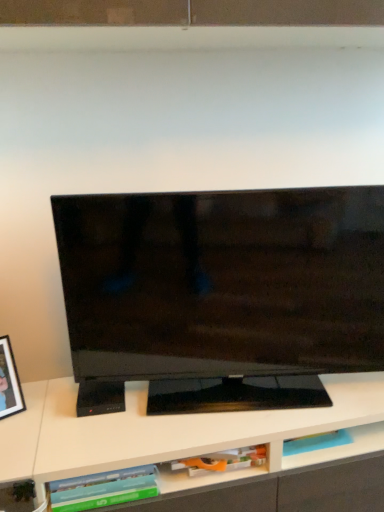
Image resolution: width=384 pixels, height=512 pixels. Find the location of `green matte book at lower center, the second book positioned from the right`. green matte book at lower center, the second book positioned from the right is located at coordinates (103, 489).

Find the location of a particular element. matte orange book at lower center, the 2th book from the left is located at coordinates (223, 461).

Can green matte book at lower center, positioned as the 1th book in left-to-right order, be found inside matte orange book at lower center, the 2th book from the left?

No, matte orange book at lower center, the 2th book from the left, does not contain green matte book at lower center, positioned as the 1th book in left-to-right order.

Which of these two, matte orange book at lower center, which is the 1th book from right to left, or green matte book at lower center, positioned as the 1th book in left-to-right order, is wider?

green matte book at lower center, positioned as the 1th book in left-to-right order, is wider.

Could you tell me if matte orange book at lower center, the 2th book from the left, is facing green matte book at lower center, positioned as the 1th book in left-to-right order?

No, matte orange book at lower center, the 2th book from the left, does not turn towards green matte book at lower center, positioned as the 1th book in left-to-right order.

Is matte orange book at lower center, which is the 1th book from right to left, in contact with green matte book at lower center, the second book positioned from the right?

They are not placed beside each other.

You are a GUI agent. You are given a task and a screenshot of the screen. Output one action in this format:
    pyautogui.click(x=<x>, y=<y>)
    Task: Click on the picture frame below the black glossy tv at center (from a real-world perspective)
    This screenshot has width=384, height=512.
    Given the screenshot: What is the action you would take?
    pyautogui.click(x=9, y=382)

Is point (8, 372) less distant than point (353, 334)?

No.

Would you say black matte picture frame at left is to the left or to the right of black glossy tv at center in the picture?

black matte picture frame at left is to the left of black glossy tv at center.

Is black matte picture frame at left closer to camera compared to black glossy tv at center?

Yes, the depth of black matte picture frame at left is less than that of black glossy tv at center.

From a real-world perspective, is black glossy tv at center on black matte picture frame at left?

Yes, from a real-world perspective, black glossy tv at center is over black matte picture frame at left

From the image's perspective, is black glossy tv at center beneath black matte picture frame at left?

No, from the image's perspective, black glossy tv at center is not below black matte picture frame at left.

Which is nearer, (149,203) or (3,355)?

The point (149,203) is closer to the camera.

Consider the image. Can you tell me how much matte orange book at lower center, which is the 1th book from right to left, and black glossy tv at center differ in facing direction?

The angular difference between matte orange book at lower center, which is the 1th book from right to left, and black glossy tv at center is 9.73 degrees.

Is matte orange book at lower center, which is the 1th book from right to left, aimed at black glossy tv at center?

No, matte orange book at lower center, which is the 1th book from right to left, is not oriented towards black glossy tv at center.

Is the depth of matte orange book at lower center, which is the 1th book from right to left, less than that of black glossy tv at center?

That is False.

Between point (249, 459) and point (73, 241), which one is positioned behind?

The point (249, 459) is farther from the camera.

Which of these two, matte orange book at lower center, which is the 1th book from right to left, or black matte picture frame at left, is wider?

Wider between the two is matte orange book at lower center, which is the 1th book from right to left.

Could you measure the distance between matte orange book at lower center, the 2th book from the left, and black matte picture frame at left?

matte orange book at lower center, the 2th book from the left, is 53.97 centimeters away from black matte picture frame at left.

Who is taller, matte orange book at lower center, which is the 1th book from right to left, or black matte picture frame at left?

Standing taller between the two is black matte picture frame at left.

Locate an element on the screen. Image resolution: width=384 pixels, height=512 pixels. the 2nd book directly beneath the black matte picture frame at left (from a real-world perspective) is located at coordinates (223, 461).

In the scene shown: Is black glossy tv at center in contact with green matte book at lower center, positioned as the 1th book in left-to-right order?

There is a gap between black glossy tv at center and green matte book at lower center, positioned as the 1th book in left-to-right order.

How much distance is there between black glossy tv at center and green matte book at lower center, positioned as the 1th book in left-to-right order?

black glossy tv at center and green matte book at lower center, positioned as the 1th book in left-to-right order, are 18.00 inches apart from each other.

In the image, is black glossy tv at center on the left side or the right side of green matte book at lower center, positioned as the 1th book in left-to-right order?

Clearly, black glossy tv at center is on the right of green matte book at lower center, positioned as the 1th book in left-to-right order, in the image.

Does black glossy tv at center have a lesser width compared to green matte book at lower center, the second book positioned from the right?

Indeed, black glossy tv at center has a lesser width compared to green matte book at lower center, the second book positioned from the right.

Between point (272, 398) and point (173, 470), which one is positioned in front?

The point (173, 470) is more forward.

Looking at this image, is there a large distance between black glossy tv at center and matte orange book at lower center, which is the 1th book from right to left?

No, black glossy tv at center is not far from matte orange book at lower center, which is the 1th book from right to left.

From the image's perspective, count 1st books downward from the black glossy tv at center and point to it. Please provide its 2D coordinates.

[(223, 461)]

Considering the relative positions of black glossy tv at center and matte orange book at lower center, the 2th book from the left, in the image provided, is black glossy tv at center behind matte orange book at lower center, the 2th book from the left,?

No, it is not.

The width and height of the screenshot is (384, 512). What are the coordinates of `book located behind the green matte book at lower center, the second book positioned from the right` in the screenshot? It's located at (223, 461).

I want to click on picture frame that is on the left side of black glossy tv at center, so click(x=9, y=382).

Which object lies nearer to the anchor point black matte picture frame at left, matte orange book at lower center, the 2th book from the left, or black glossy tv at center?

Based on the image, matte orange book at lower center, the 2th book from the left, appears to be nearer to black matte picture frame at left.

Considering their positions, is green matte book at lower center, the second book positioned from the right, positioned closer to black matte picture frame at left than black glossy tv at center?

green matte book at lower center, the second book positioned from the right.

Based on the photo, which object lies nearer to the anchor point black matte picture frame at left, matte orange book at lower center, which is the 1th book from right to left, or green matte book at lower center, positioned as the 1th book in left-to-right order?

green matte book at lower center, positioned as the 1th book in left-to-right order, lies closer to black matte picture frame at left than the other object.

Which object lies nearer to the anchor point black glossy tv at center, black matte picture frame at left or green matte book at lower center, positioned as the 1th book in left-to-right order?

green matte book at lower center, positioned as the 1th book in left-to-right order.

Based on the photo, looking at the image, which one is located further to matte orange book at lower center, the 2th book from the left, black glossy tv at center or black matte picture frame at left?

The object further to matte orange book at lower center, the 2th book from the left, is black matte picture frame at left.

Which object lies further to the anchor point black glossy tv at center, green matte book at lower center, the second book positioned from the right, or matte orange book at lower center, the 2th book from the left?

green matte book at lower center, the second book positioned from the right.

From the image, which object appears to be nearer to black glossy tv at center, matte orange book at lower center, which is the 1th book from right to left, or green matte book at lower center, the second book positioned from the right?

matte orange book at lower center, which is the 1th book from right to left, is positioned closer to the anchor black glossy tv at center.

Based on their spatial positions, is green matte book at lower center, the second book positioned from the right, or black glossy tv at center closer to matte orange book at lower center, the 2th book from the left?

green matte book at lower center, the second book positioned from the right.

You are a GUI agent. You are given a task and a screenshot of the screen. Output one action in this format:
    pyautogui.click(x=<x>, y=<y>)
    Task: Click on the book situated between black matte picture frame at left and matte orange book at lower center, the 2th book from the left, from left to right
    The width and height of the screenshot is (384, 512).
    Given the screenshot: What is the action you would take?
    pyautogui.click(x=103, y=489)

Locate an element on the screen. book between black glossy tv at center and green matte book at lower center, positioned as the 1th book in left-to-right order, from top to bottom is located at coordinates (223, 461).